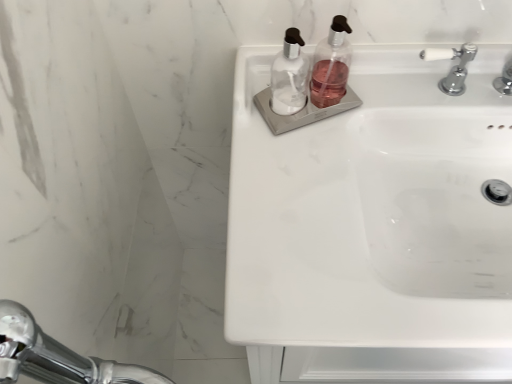
Locate an element on the screen. The image size is (512, 384). unoccupied region to the right of transparent plastic soap dispenser at upper center, which ranks as the second soap dispenser in left-to-right order is located at coordinates (395, 73).